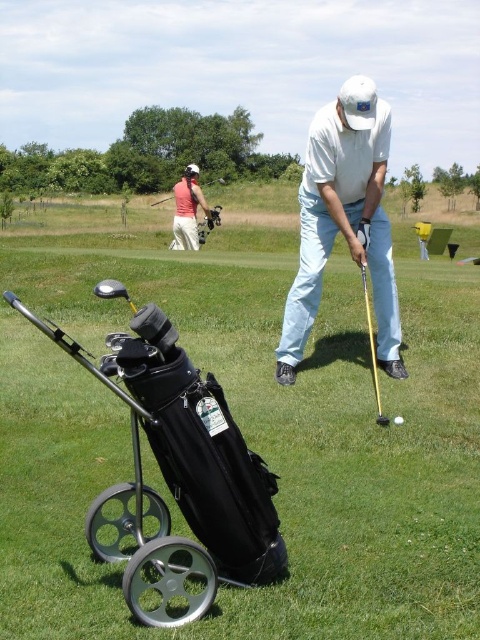
You are a golfer who wants to know which object is taller between the black fabric golf bag at lower left and the matte pink shirt at upper left. Can you help?

The black fabric golf bag at lower left has a greater height compared to the matte pink shirt at upper left, so the black fabric golf bag at lower left is taller.

You are standing at the golf course and see two points marked in the scene. Which of the two points, point (308, 216) or point (178, 244), is closer to you?

Point (308, 216) is closer to the viewer than point (178, 244).

In the scene shown: You are a golfer standing at the tee. You see the black fabric golf bag at lower left and the matte pink shirt at upper left. Which object is closer to you?

The black fabric golf bag at lower left is closer to you because it is in front of the matte pink shirt at upper left.